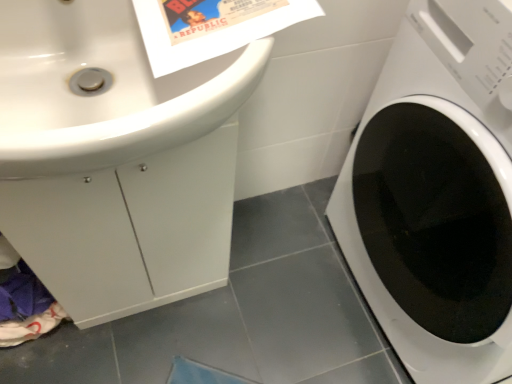
What is the approximate height of white glossy sink at upper left?

white glossy sink at upper left is 6.15 inches in height.

The height and width of the screenshot is (384, 512). What do you see at coordinates (103, 89) in the screenshot?
I see `white glossy sink at upper left` at bounding box center [103, 89].

Where is `white glossy sink at upper left`? This screenshot has height=384, width=512. white glossy sink at upper left is located at coordinates (103, 89).

In order to face white glossy sink at upper left, should I rotate leftwards or rightwards?

Rotate left and turn 16.134 degrees.

Measure the distance between white glossy washing machine at right and camera.

57.26 centimeters.

Find the location of a particular element. The height and width of the screenshot is (384, 512). white glossy washing machine at right is located at coordinates (437, 193).

The width and height of the screenshot is (512, 384). Describe the element at coordinates (437, 193) in the screenshot. I see `white glossy washing machine at right` at that location.

Locate an element on the screen. white glossy sink at upper left is located at coordinates (103, 89).

Is white glossy sink at upper left at the left side of white glossy washing machine at right?

Indeed, white glossy sink at upper left is positioned on the left side of white glossy washing machine at right.

Is the position of white glossy sink at upper left more distant than that of white glossy washing machine at right?

No, it is not.

Is point (36, 141) farther from camera compared to point (429, 359)?

No, it is in front of (429, 359).

From the image's perspective, does white glossy sink at upper left appear higher than white glossy washing machine at right?

Correct, white glossy sink at upper left appears higher than white glossy washing machine at right in the image.

From a real-world perspective, is white glossy sink at upper left located higher than white glossy washing machine at right?

Correct, in the physical world, white glossy sink at upper left is higher than white glossy washing machine at right.

Can you confirm if white glossy sink at upper left is thinner than white glossy washing machine at right?

Indeed, white glossy sink at upper left has a lesser width compared to white glossy washing machine at right.

Considering the sizes of objects white glossy sink at upper left and white glossy washing machine at right in the image provided, who is taller, white glossy sink at upper left or white glossy washing machine at right?

Standing taller between the two is white glossy washing machine at right.

Consider the image. Is white glossy sink at upper left bigger than white glossy washing machine at right?

No, white glossy sink at upper left is not bigger than white glossy washing machine at right.

Is white glossy sink at upper left positioned beyond the bounds of white glossy washing machine at right?

white glossy sink at upper left lies outside white glossy washing machine at right's area.

Is white glossy sink at upper left in contact with white glossy washing machine at right?

white glossy sink at upper left and white glossy washing machine at right are clearly separated.

Is white glossy sink at upper left oriented away from white glossy washing machine at right?

No, white glossy sink at upper left is not facing the opposite direction of white glossy washing machine at right.

How many degrees apart are the facing directions of white glossy sink at upper left and white glossy washing machine at right?

There is a 88.5-degree angle between the facing directions of white glossy sink at upper left and white glossy washing machine at right.

Image resolution: width=512 pixels, height=384 pixels. What are the coordinates of `washing machine below the white glossy sink at upper left (from a real-world perspective)` in the screenshot? It's located at point(437,193).

Between white glossy washing machine at right and white glossy sink at upper left, which one appears on the left side from the viewer's perspective?

white glossy sink at upper left is more to the left.

Which object is closer to the camera, white glossy washing machine at right or white glossy sink at upper left?

Positioned in front is white glossy sink at upper left.

Considering the points (472, 121) and (42, 36), which point is behind, point (472, 121) or point (42, 36)?

The point (472, 121) is farther.

From the image's perspective, who appears lower, white glossy washing machine at right or white glossy sink at upper left?

white glossy washing machine at right.

From a real-world perspective, which object rests below the other?

From a 3D spatial view, white glossy washing machine at right is below.

Considering the relative sizes of white glossy washing machine at right and white glossy sink at upper left in the image provided, is white glossy washing machine at right thinner than white glossy sink at upper left?

No, white glossy washing machine at right is not thinner than white glossy sink at upper left.

In terms of height, does white glossy washing machine at right look taller or shorter compared to white glossy sink at upper left?

Considering their sizes, white glossy washing machine at right has more height than white glossy sink at upper left.

Who is bigger, white glossy washing machine at right or white glossy sink at upper left?

white glossy washing machine at right.

Do you think white glossy washing machine at right is within white glossy sink at upper left, or outside of it?

white glossy washing machine at right is outside white glossy sink at upper left.

Does white glossy washing machine at right touch white glossy sink at upper left?

No, white glossy washing machine at right is not beside white glossy sink at upper left.

Does white glossy washing machine at right turn towards white glossy sink at upper left?

Yes, white glossy washing machine at right is turned towards white glossy sink at upper left.

How distant is white glossy washing machine at right from white glossy sink at upper left?

A distance of 52.99 centimeters exists between white glossy washing machine at right and white glossy sink at upper left.

Find the location of a particular element. The height and width of the screenshot is (384, 512). washing machine to the right of white glossy sink at upper left is located at coordinates (437, 193).

This screenshot has width=512, height=384. What are the coordinates of `washing machine that appears on the right of white glossy sink at upper left` in the screenshot? It's located at pos(437,193).

You are a GUI agent. You are given a task and a screenshot of the screen. Output one action in this format:
    pyautogui.click(x=<x>, y=<y>)
    Task: Click on the washing machine located underneath the white glossy sink at upper left (from a real-world perspective)
    This screenshot has width=512, height=384.
    Given the screenshot: What is the action you would take?
    pyautogui.click(x=437, y=193)